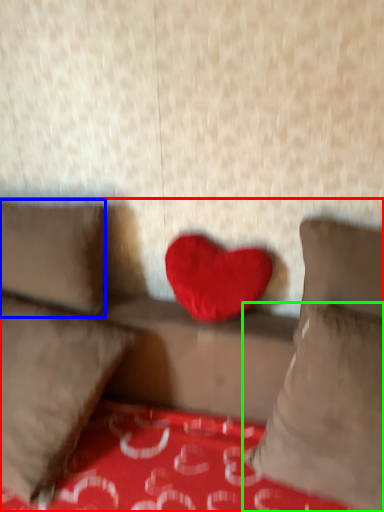
Question: Based on their relative distances, which object is nearer to studio couch (highlighted by a red box)? Choose from pillow (highlighted by a blue box) and pillow (highlighted by a green box).

Choices:
 (A) pillow
 (B) pillow

Answer: (A)